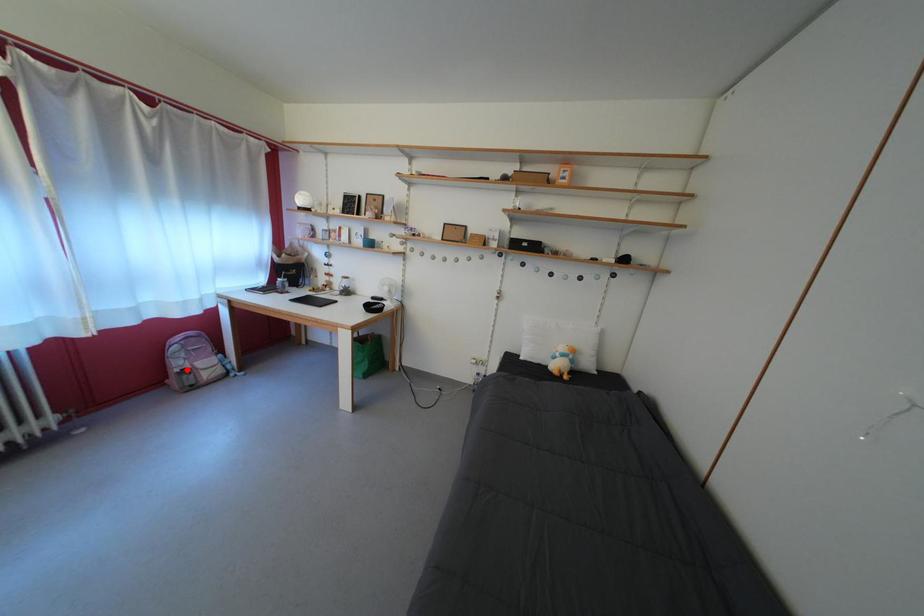
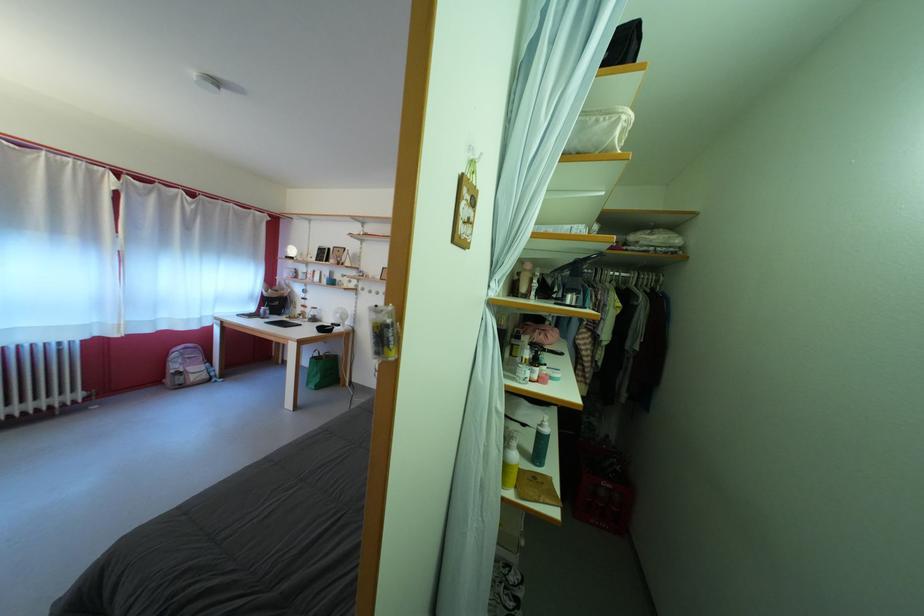
In the second image, find the point that corresponds to the highlighted location in the first image.

(184, 373)